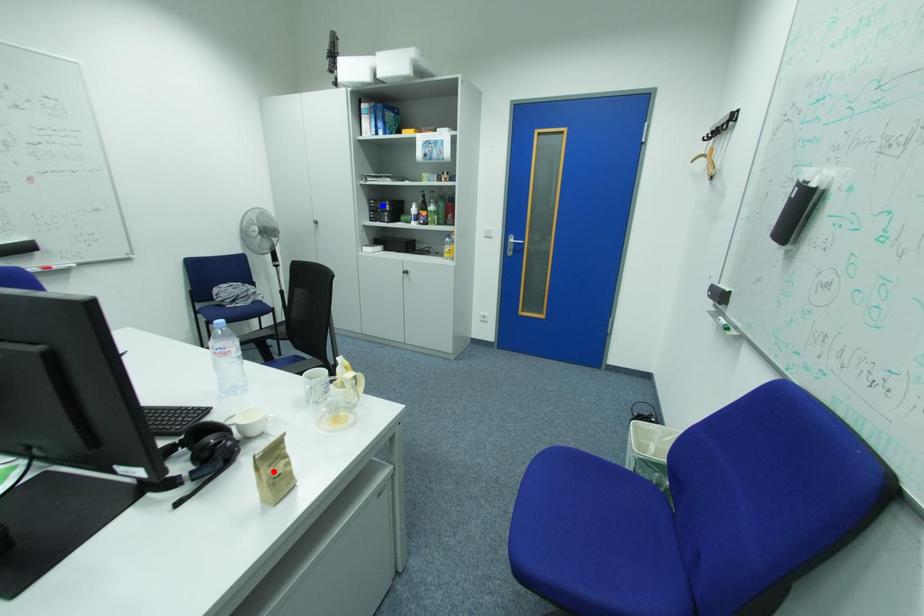
Question: In the image, two points are highlighted. Which point is nearer to the camera? Reply with the corresponding letter.

Choices:
 (A) blue point
 (B) red point

Answer: (B)